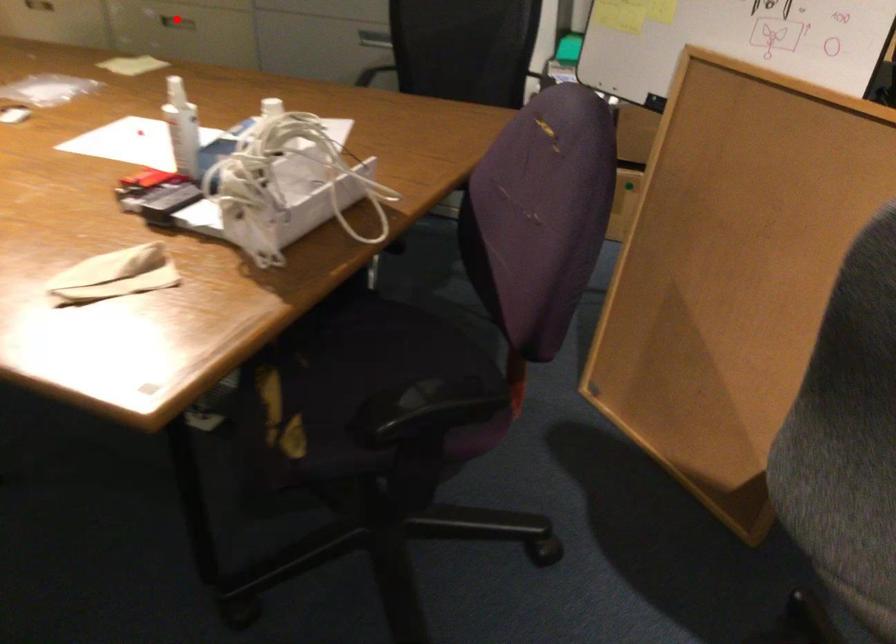
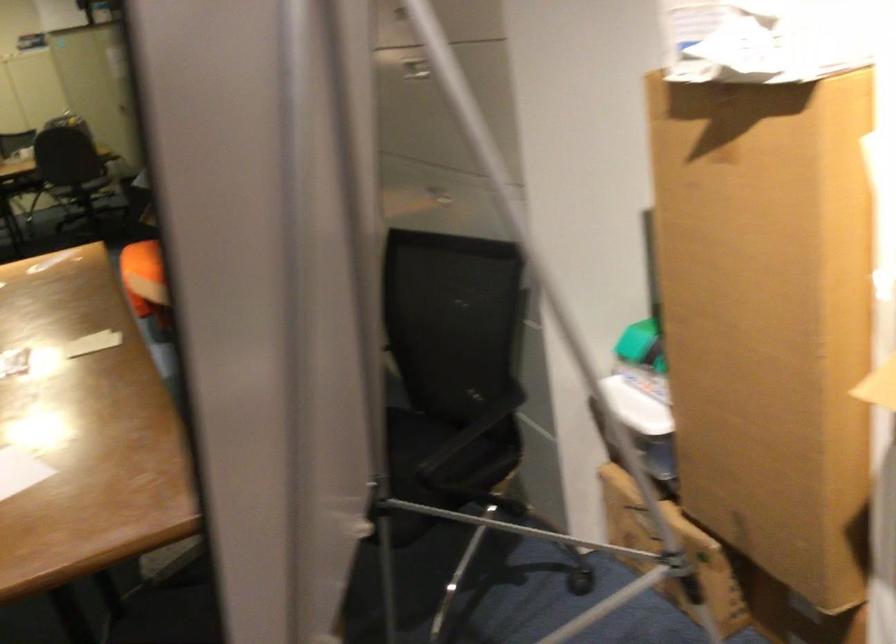
Question: I am providing you with two images of the same scene from different viewpoints. A red point is marked on the first image. At the location where the point appears in image 1, is it still visible in image 2?

Choices:
 (A) Yes
 (B) No

Answer: (B)